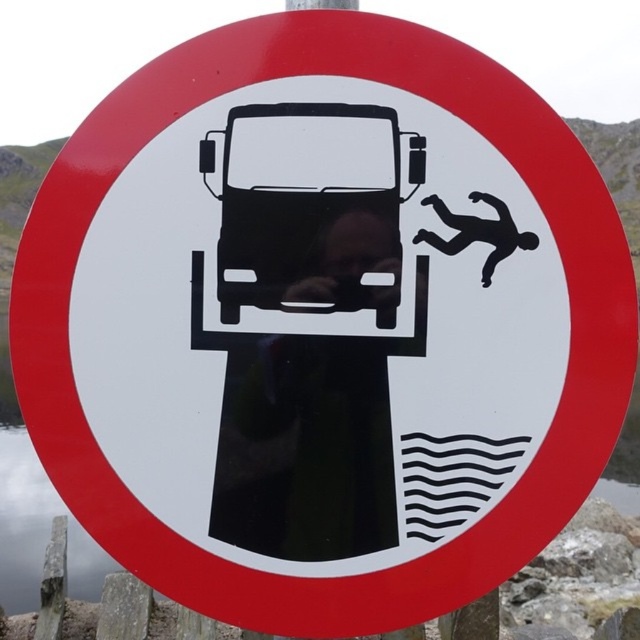
Can you confirm if black glossy car at center is bigger than wavy lines water at lower center?

Actually, black glossy car at center might be smaller than wavy lines water at lower center.

Does black glossy car at center appear on the right side of wavy lines water at lower center?

Yes, black glossy car at center is to the right of wavy lines water at lower center.

Between point (312, 515) and point (72, 524), which one is positioned behind?

The point (72, 524) is more distant.

This screenshot has width=640, height=640. In order to click on black glossy car at center in this screenshot , I will do `click(307, 449)`.